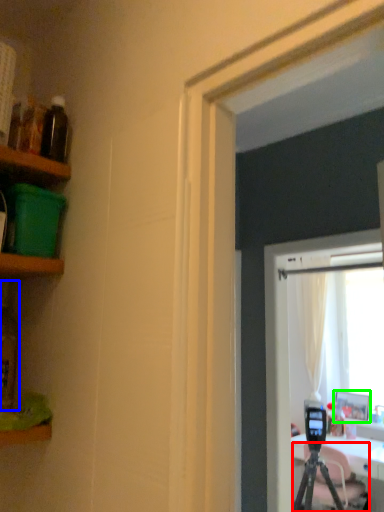
Question: Estimate the real-world distances between objects in this image. Which object is closer to tripod (highlighted by a red box), bottle (highlighted by a blue box) or picture frame (highlighted by a green box)?

Choices:
 (A) bottle
 (B) picture frame

Answer: (B)